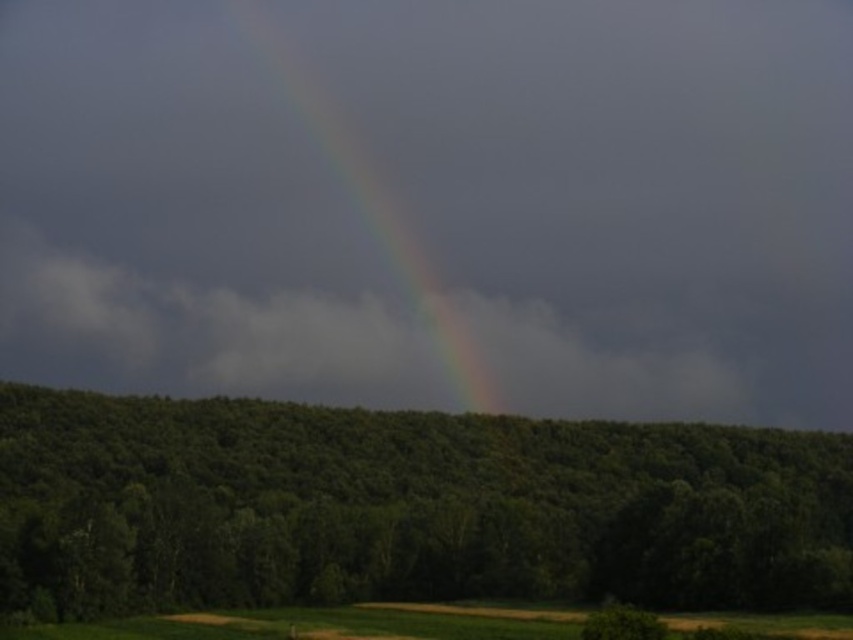
Question: Which object appears farthest from the camera in this image?

Choices:
 (A) green leafy tree at center
 (B) rainbow at center
 (C) green grassy field at lower center

Answer: (B)

Question: Does green leafy tree at center appear under rainbow at center?

Choices:
 (A) yes
 (B) no

Answer: (A)

Question: Among these points, which one is nearest to the camera?

Choices:
 (A) (387, 182)
 (B) (403, 620)

Answer: (B)

Question: Which point is farther to the camera?

Choices:
 (A) green grassy field at lower center
 (B) green leafy tree at center
 (C) rainbow at center

Answer: (C)

Question: Observing the image, what is the correct spatial positioning of green leafy tree at center in reference to green grassy field at lower center?

Choices:
 (A) above
 (B) below

Answer: (A)

Question: Is green grassy field at lower center to the left of rainbow at center from the viewer's perspective?

Choices:
 (A) no
 (B) yes

Answer: (A)